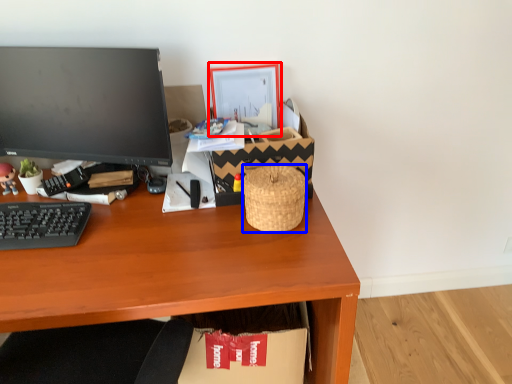
Question: Among these objects, which one is nearest to the camera, picture frame (highlighted by a red box) or basket (highlighted by a blue box)?

Choices:
 (A) picture frame
 (B) basket

Answer: (B)